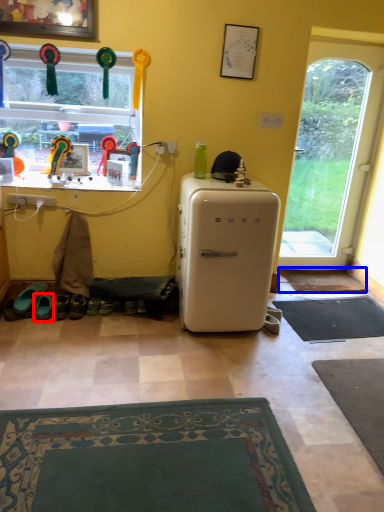
Question: Which point is closer to the camera, footwear (highlighted by a red box) or mat (highlighted by a blue box)?

Choices:
 (A) footwear
 (B) mat

Answer: (A)